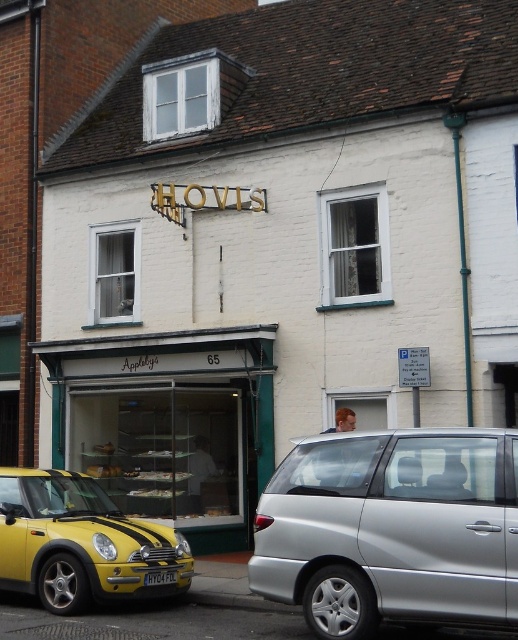
Is yellow matte car at lower left shorter than yellow plastic license plate at lower center?

In fact, yellow matte car at lower left may be taller than yellow plastic license plate at lower center.

The height and width of the screenshot is (640, 518). I want to click on yellow matte car at lower left, so click(79, 541).

Find the location of a particular element. yellow matte car at lower left is located at coordinates (79, 541).

Who is lower down, silver metallic van at lower right or yellow plastic license plate at lower center?

Positioned lower is yellow plastic license plate at lower center.

Is silver metallic van at lower right to the right of yellow plastic license plate at lower center from the viewer's perspective?

Yes, silver metallic van at lower right is to the right of yellow plastic license plate at lower center.

Does point (365, 595) come closer to viewer compared to point (168, 570)?

Yes, it is.

Find the location of a particular element. This screenshot has width=518, height=640. silver metallic van at lower right is located at coordinates (392, 529).

Can you confirm if silver metallic van at lower right is bigger than yellow matte car at lower left?

Correct, silver metallic van at lower right is larger in size than yellow matte car at lower left.

The height and width of the screenshot is (640, 518). In order to click on silver metallic van at lower right in this screenshot , I will do `click(392, 529)`.